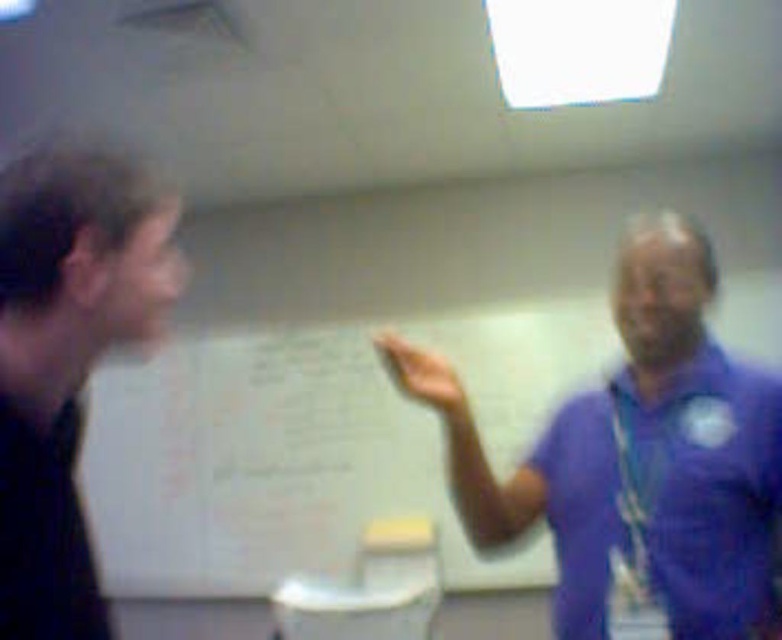
Question: Which point appears closest to the camera in this image?

Choices:
 (A) pos(641,428)
 (B) pos(23,310)
 (C) pos(364,448)

Answer: (B)

Question: Which of these objects is positioned closest to the black matte shirt at left?

Choices:
 (A) purple matte shirt at center
 (B) white matte bulletin board at center

Answer: (A)

Question: Among these objects, which one is nearest to the camera?

Choices:
 (A) black matte shirt at left
 (B) white matte bulletin board at center

Answer: (A)

Question: Is purple matte shirt at center below black matte shirt at left?

Choices:
 (A) no
 (B) yes

Answer: (B)

Question: Is white matte bulletin board at center thinner than purple matte shirt at center?

Choices:
 (A) no
 (B) yes

Answer: (A)

Question: Does white matte bulletin board at center have a greater width compared to purple matte shirt at center?

Choices:
 (A) no
 (B) yes

Answer: (B)